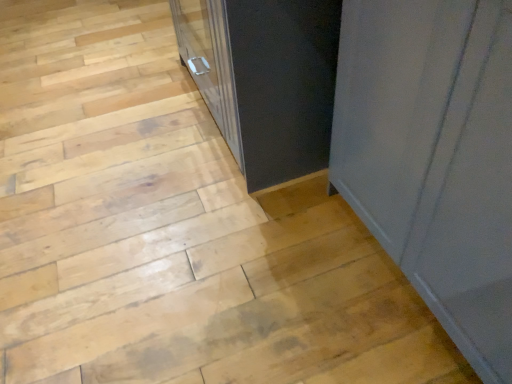
This screenshot has width=512, height=384. What do you see at coordinates (434, 156) in the screenshot? I see `matte gray cabinet at right` at bounding box center [434, 156].

This screenshot has width=512, height=384. What are the coordinates of `matte gray cabinet at right` in the screenshot? It's located at (434, 156).

Image resolution: width=512 pixels, height=384 pixels. Find the location of `matte gray cabinet at right`. matte gray cabinet at right is located at coordinates (434, 156).